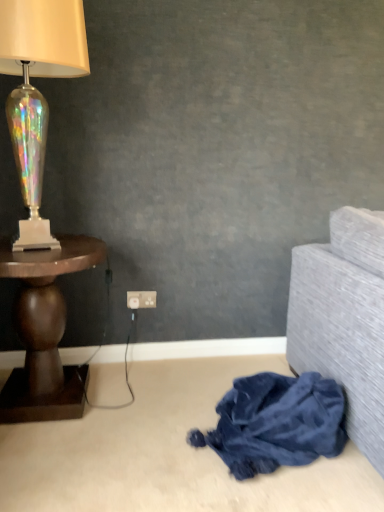
Question: From a real-world perspective, does white plastic power outlet at center stand above velvety blue blanket at lower right?

Choices:
 (A) no
 (B) yes

Answer: (B)

Question: From the image's perspective, would you say white plastic power outlet at center is positioned over velvety blue blanket at lower right?

Choices:
 (A) yes
 (B) no

Answer: (A)

Question: Considering the relative sizes of white plastic power outlet at center and velvety blue blanket at lower right in the image provided, is white plastic power outlet at center taller than velvety blue blanket at lower right?

Choices:
 (A) yes
 (B) no

Answer: (B)

Question: Does white plastic power outlet at center have a smaller size compared to velvety blue blanket at lower right?

Choices:
 (A) no
 (B) yes

Answer: (B)

Question: Is white plastic power outlet at center to the left of velvety blue blanket at lower right from the viewer's perspective?

Choices:
 (A) no
 (B) yes

Answer: (B)

Question: Is white plastic power outlet at center positioned far away from velvety blue blanket at lower right?

Choices:
 (A) yes
 (B) no

Answer: (B)

Question: Is dark wood table at left completely or partially inside velvety blue blanket at lower right?

Choices:
 (A) yes
 (B) no

Answer: (B)

Question: From a real-world perspective, does velvety blue blanket at lower right sit lower than dark wood table at left?

Choices:
 (A) no
 (B) yes

Answer: (B)

Question: Considering the relative sizes of velvety blue blanket at lower right and dark wood table at left in the image provided, is velvety blue blanket at lower right bigger than dark wood table at left?

Choices:
 (A) no
 (B) yes

Answer: (A)

Question: Considering the relative positions of velvety blue blanket at lower right and dark wood table at left in the image provided, is velvety blue blanket at lower right to the left of dark wood table at left from the viewer's perspective?

Choices:
 (A) yes
 (B) no

Answer: (B)

Question: Considering the relative positions of velvety blue blanket at lower right and dark wood table at left in the image provided, is velvety blue blanket at lower right to the right of dark wood table at left from the viewer's perspective?

Choices:
 (A) yes
 (B) no

Answer: (A)

Question: Can you confirm if velvety blue blanket at lower right is thinner than dark wood table at left?

Choices:
 (A) yes
 (B) no

Answer: (A)

Question: Are velvety blue blanket at lower right and white plastic power outlet at center located far from each other?

Choices:
 (A) no
 (B) yes

Answer: (A)